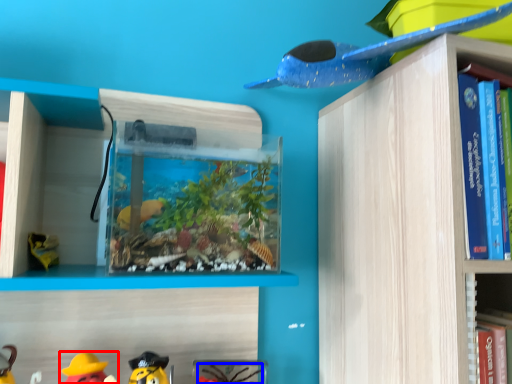
Question: Among these objects, which one is nearest to the camera, toy (highlighted by a red box) or toy (highlighted by a blue box)?

Choices:
 (A) toy
 (B) toy

Answer: (A)